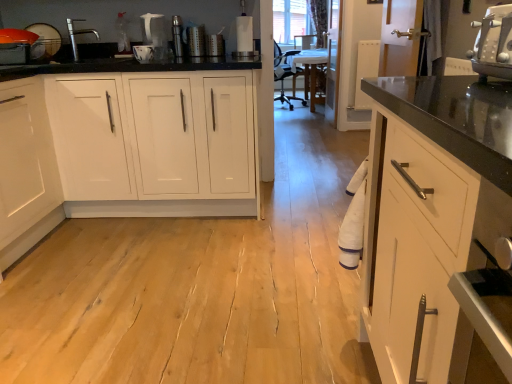
What is the approximate width of metallic cylindrical at center, the second appliance positioned from the left?

metallic cylindrical at center, the second appliance positioned from the left, is 5.36 centimeters in width.

Where is `white glossy cabinet at left`? The height and width of the screenshot is (384, 512). white glossy cabinet at left is located at coordinates (128, 147).

The height and width of the screenshot is (384, 512). What do you see at coordinates (196, 40) in the screenshot? I see `metallic silver grater at upper center, which is the third appliance from left to right` at bounding box center [196, 40].

The image size is (512, 384). Find the location of `white plastic toaster at upper right`. white plastic toaster at upper right is located at coordinates (493, 44).

Is point (77, 60) closer to camera compared to point (198, 47)?

That is True.

Considering the sizes of objects satin nickel faucet at upper left and metallic silver grater at upper center, which is the 1th appliance from right to left, in the image provided, who is taller, satin nickel faucet at upper left or metallic silver grater at upper center, which is the 1th appliance from right to left,?

satin nickel faucet at upper left.

Is satin nickel faucet at upper left outside of metallic silver grater at upper center, which is the 1th appliance from right to left?

That's correct, satin nickel faucet at upper left is outside of metallic silver grater at upper center, which is the 1th appliance from right to left.

How much distance is there between satin nickel faucet at upper left and metallic silver grater at upper center, which is the third appliance from left to right?

23.44 inches.

From the image's perspective, is matte black sink at left, which is counted as the 3th appliance, starting from the right, above or below white glossy cabinet at left?

matte black sink at left, which is counted as the 3th appliance, starting from the right, is above white glossy cabinet at left.

Considering the positions of points (50, 38) and (32, 245), is point (50, 38) farther from camera compared to point (32, 245)?

Yes, point (50, 38) is farther from viewer.

Are matte black sink at left, the first appliance viewed from the left, and white glossy cabinet at left making contact?

They are not placed beside each other.

How distant is matte black sink at left, which is counted as the 3th appliance, starting from the right, from white glossy cabinet at left?

matte black sink at left, which is counted as the 3th appliance, starting from the right, is 30.57 inches from white glossy cabinet at left.

Which point is more forward, (x=182, y=29) or (x=35, y=44)?

The point (x=35, y=44) is closer.

There is a matte black sink at left, the first appliance viewed from the left. What are the coordinates of `the 2nd appliance above it (from the image's perspective)` in the screenshot? It's located at (178, 36).

Is matte black sink at left, which is counted as the 3th appliance, starting from the right, inside metallic cylindrical at center, arranged as the second appliance when viewed from the right?

No, matte black sink at left, which is counted as the 3th appliance, starting from the right, is not inside metallic cylindrical at center, arranged as the second appliance when viewed from the right.

Could you tell me if white plastic toaster at upper right is turned towards matte black sink at left, the first appliance viewed from the left?

No, white plastic toaster at upper right does not turn towards matte black sink at left, the first appliance viewed from the left.

Between point (488, 16) and point (31, 48), which one is positioned behind?

The point (31, 48) is behind.

Is white plastic toaster at upper right placed right next to matte black sink at left, which is counted as the 3th appliance, starting from the right?

No, white plastic toaster at upper right is not making contact with matte black sink at left, which is counted as the 3th appliance, starting from the right.

Between white plastic toaster at upper right and matte black sink at left, the first appliance viewed from the left, which one is positioned in front?

white plastic toaster at upper right.

Is satin nickel faucet at upper left wider than white plastic toaster at upper right?

In fact, satin nickel faucet at upper left might be narrower than white plastic toaster at upper right.

From the image's perspective, which is below, satin nickel faucet at upper left or white plastic toaster at upper right?

white plastic toaster at upper right, from the image's perspective.

Which is behind, point (63, 49) or point (472, 65)?

The point (63, 49) is behind.

Looking at this image, are satin nickel faucet at upper left and white plastic toaster at upper right beside each other?

No, satin nickel faucet at upper left is not next to white plastic toaster at upper right.

Which is in front, point (485, 43) or point (92, 50)?

The point (485, 43) is closer to the camera.

From their relative heights in the image, would you say white plastic toaster at upper right is taller or shorter than satin nickel faucet at upper left?

Considering their sizes, white plastic toaster at upper right has less height than satin nickel faucet at upper left.

Is white plastic toaster at upper right facing away from satin nickel faucet at upper left?

white plastic toaster at upper right does not have its back to satin nickel faucet at upper left.

Considering the points (34, 59) and (194, 28), which point is behind, point (34, 59) or point (194, 28)?

The point (194, 28) is farther from the camera.

Considering the positions of objects matte black sink at left, the first appliance viewed from the left, and metallic silver grater at upper center, which is the 1th appliance from right to left, in the image provided, who is more to the left, matte black sink at left, the first appliance viewed from the left, or metallic silver grater at upper center, which is the 1th appliance from right to left,?

matte black sink at left, the first appliance viewed from the left, is more to the left.

Is matte black sink at left, the first appliance viewed from the left, oriented away from metallic silver grater at upper center, which is the third appliance from left to right?

No, matte black sink at left, the first appliance viewed from the left, is not facing away from metallic silver grater at upper center, which is the third appliance from left to right.

Looking at their sizes, would you say matte black sink at left, the first appliance viewed from the left, is wider or thinner than metallic silver grater at upper center, which is the third appliance from left to right?

In the image, matte black sink at left, the first appliance viewed from the left, appears to be more narrow than metallic silver grater at upper center, which is the third appliance from left to right.

From a real-world perspective, which appliance is the 2nd one underneath the satin nickel faucet at upper left? Please provide its 2D coordinates.

[(196, 40)]

Which appliance is the 1st one when counting from the back of the white glossy cabinet at left? Please provide its 2D coordinates.

[(44, 41)]

Which object lies further to the anchor point white glossy cabinet at left, matte black sink at left, which is counted as the 3th appliance, starting from the right, or metallic silver grater at upper center, which is the third appliance from left to right?

Based on the image, metallic silver grater at upper center, which is the third appliance from left to right, appears to be further to white glossy cabinet at left.

When comparing their distances from satin nickel faucet at upper left, does matte black sink at left, the first appliance viewed from the left, or white glossy cabinet at left seem further?

Among the two, white glossy cabinet at left is located further to satin nickel faucet at upper left.

Based on their spatial positions, is white plastic toaster at upper right or satin nickel faucet at upper left further from metallic silver grater at upper center, which is the 1th appliance from right to left?

The object further to metallic silver grater at upper center, which is the 1th appliance from right to left, is white plastic toaster at upper right.

Considering their positions, is metallic silver grater at upper center, which is the third appliance from left to right, positioned further to metallic cylindrical at center, the second appliance positioned from the left, than matte black sink at left, which is counted as the 3th appliance, starting from the right?

matte black sink at left, which is counted as the 3th appliance, starting from the right.

Estimate the real-world distances between objects in this image. Which object is further from metallic cylindrical at center, arranged as the second appliance when viewed from the right, matte black sink at left, the first appliance viewed from the left, or white glossy cabinet at left?

white glossy cabinet at left lies further to metallic cylindrical at center, arranged as the second appliance when viewed from the right, than the other object.

Consider the image. When comparing their distances from satin nickel faucet at upper left, does white plastic toaster at upper right or matte black sink at left, the first appliance viewed from the left, seem closer?

matte black sink at left, the first appliance viewed from the left.

Looking at the image, which one is located closer to white plastic toaster at upper right, satin nickel faucet at upper left or metallic cylindrical at center, arranged as the second appliance when viewed from the right?

The object closer to white plastic toaster at upper right is metallic cylindrical at center, arranged as the second appliance when viewed from the right.

From the image, which object appears to be farther from metallic silver grater at upper center, which is the third appliance from left to right, white plastic toaster at upper right or metallic cylindrical at center, arranged as the second appliance when viewed from the right?

white plastic toaster at upper right is positioned further to the anchor metallic silver grater at upper center, which is the third appliance from left to right.

Where is `sink between metallic cylindrical at center, the second appliance positioned from the left, and white glossy cabinet at left vertically`? The width and height of the screenshot is (512, 384). sink between metallic cylindrical at center, the second appliance positioned from the left, and white glossy cabinet at left vertically is located at coordinates (84, 46).

Find the location of `appliance between matte black sink at left, the first appliance viewed from the left, and metallic silver grater at upper center, which is the 1th appliance from right to left, in the horizontal direction`. appliance between matte black sink at left, the first appliance viewed from the left, and metallic silver grater at upper center, which is the 1th appliance from right to left, in the horizontal direction is located at coordinates (178, 36).

This screenshot has height=384, width=512. I want to click on cabinetry between satin nickel faucet at upper left and white plastic toaster at upper right from left to right, so click(128, 147).

Where is `cabinetry between white plastic toaster at upper right and metallic silver grater at upper center, which is the 1th appliance from right to left, in the front-back direction`? cabinetry between white plastic toaster at upper right and metallic silver grater at upper center, which is the 1th appliance from right to left, in the front-back direction is located at coordinates (128, 147).